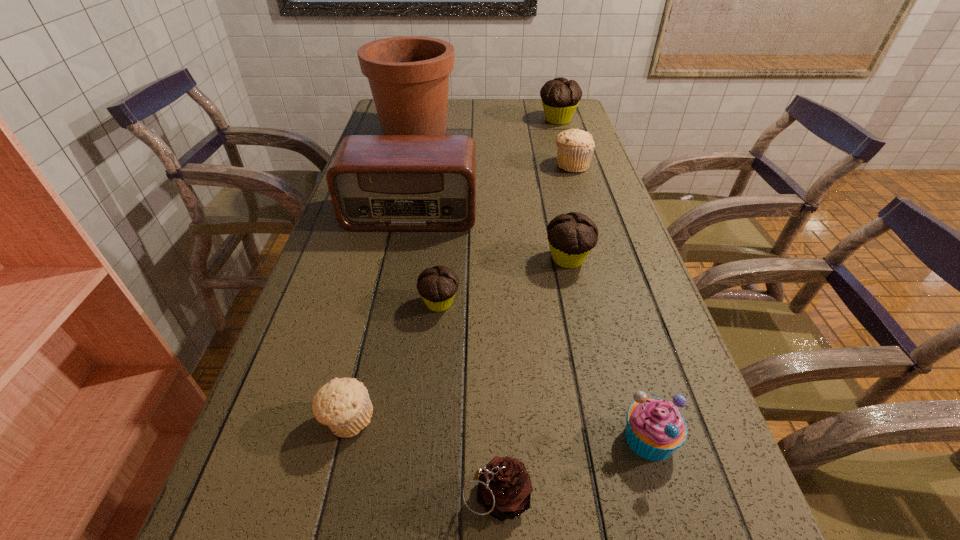
Where is `pinecone`? The height and width of the screenshot is (540, 960). pinecone is located at coordinates (504, 489).

Locate an element on the screen. the nearest object is located at coordinates (504, 489).

I want to click on the left beige muffin, so click(343, 405).

Where is `the leftmost muffin`? This screenshot has height=540, width=960. the leftmost muffin is located at coordinates (343, 405).

Identify the location of the leftmost chocolate muffin. (437, 286).

At what (x,y) coordinates should I click in order to perform the action: click on the fourth nearest object. Please return your answer as a coordinate pair (x, y). The image size is (960, 540). Looking at the image, I should click on click(x=437, y=286).

Where is `free location located 0.050m on the front of the flowerpot`? The image size is (960, 540). free location located 0.050m on the front of the flowerpot is located at coordinates (408, 160).

Identify the location of vacant region located 0.350m on the front panel of the sixth nearest object. (386, 340).

The height and width of the screenshot is (540, 960). I want to click on vacant area situated on the front of the tallest muffin, so click(563, 136).

I want to click on vacant space located on the front of the right beige muffin, so click(x=601, y=261).